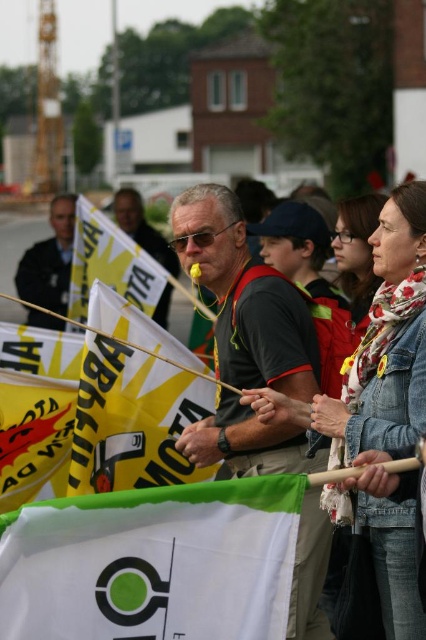
Question: Considering the real-world distances, which object is farthest from the green fabric flag at center?

Choices:
 (A) matte black shirt at center
 (B) floral scarf at center

Answer: (B)

Question: Based on their relative distances, which object is nearer to the white floral scarf at center?

Choices:
 (A) yellow fabric flag at center
 (B) yellow/yellowish paper at center
 (C) white fabric flag at lower center
 (D) yellow fabric flag at lower left

Answer: (B)

Question: Is yellow paper flag at lower left wider than green fabric flag at center?

Choices:
 (A) no
 (B) yes

Answer: (B)

Question: Can you confirm if white fabric flag at lower center is positioned to the right of yellow/yellowish paper at center?

Choices:
 (A) yes
 (B) no

Answer: (A)

Question: Which of the following is the farthest from the observer?

Choices:
 (A) (233, 403)
 (B) (376, 205)
 (C) (388, 508)
 (D) (201, 323)

Answer: (D)

Question: Is matte black shirt at center to the left of white floral scarf at center from the viewer's perspective?

Choices:
 (A) no
 (B) yes

Answer: (B)